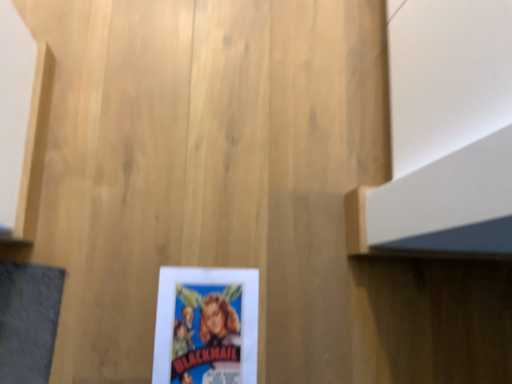
The image size is (512, 384). What do you see at coordinates (206, 326) in the screenshot?
I see `blue paper poster at center` at bounding box center [206, 326].

At what (x,y) coordinates should I click in order to perform the action: click on blue paper poster at center. Please return your answer as a coordinate pair (x, y). Looking at the image, I should click on (206, 326).

Locate an element on the screen. The width and height of the screenshot is (512, 384). blue paper poster at center is located at coordinates (206, 326).